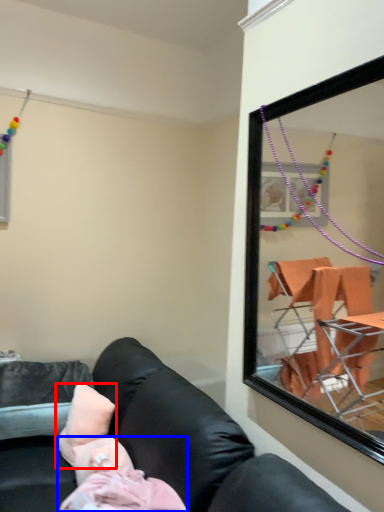
Question: Which object appears closest to the camera in this image, pillow (highlighted by a red box) or person (highlighted by a blue box)?

Choices:
 (A) pillow
 (B) person

Answer: (B)